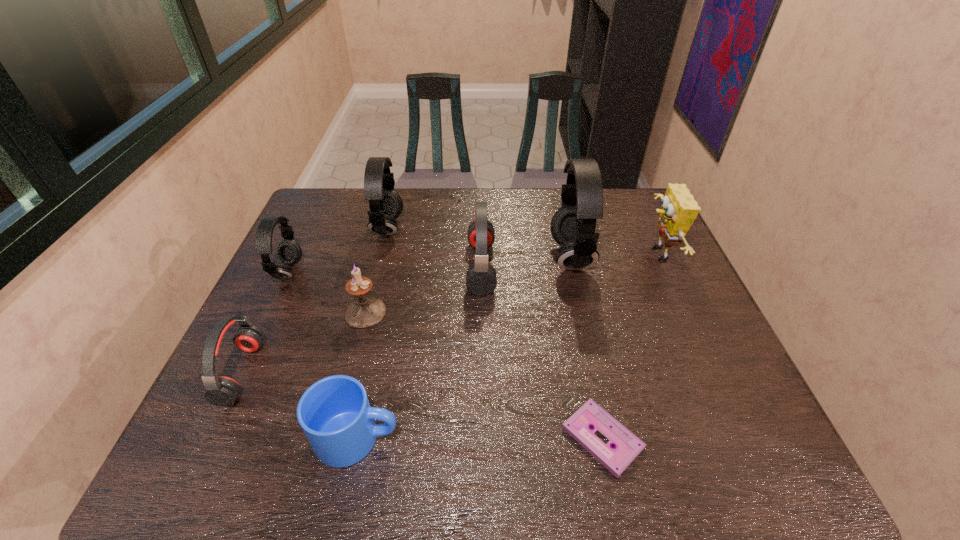
The height and width of the screenshot is (540, 960). Identify the location of vacant space at the far left corner of the desktop. (338, 218).

Find the location of a particular element. The width and height of the screenshot is (960, 540). vacant space at the far right corner of the desktop is located at coordinates (647, 227).

This screenshot has height=540, width=960. In order to click on free space between the farther red earphone and the tallest object in this screenshot , I will do `click(526, 262)`.

The width and height of the screenshot is (960, 540). I want to click on free space between the tallest earphone and the second shortest object, so click(464, 347).

Identify the location of free space that is in between the videotape and the eighth tallest object. (480, 438).

Image resolution: width=960 pixels, height=540 pixels. I want to click on free spot between the sixth farthest object and the rightmost object, so [512, 283].

The width and height of the screenshot is (960, 540). I want to click on empty space that is in between the rightmost object and the second tallest earphone, so coord(522,241).

In order to click on free space between the biggest black earphone and the farther red earphone in this screenshot , I will do `click(526, 262)`.

Where is `free space between the mug and the rightmost object`? Image resolution: width=960 pixels, height=540 pixels. free space between the mug and the rightmost object is located at coordinates (508, 346).

The height and width of the screenshot is (540, 960). I want to click on free spot between the biggest black earphone and the right red earphone, so click(x=526, y=262).